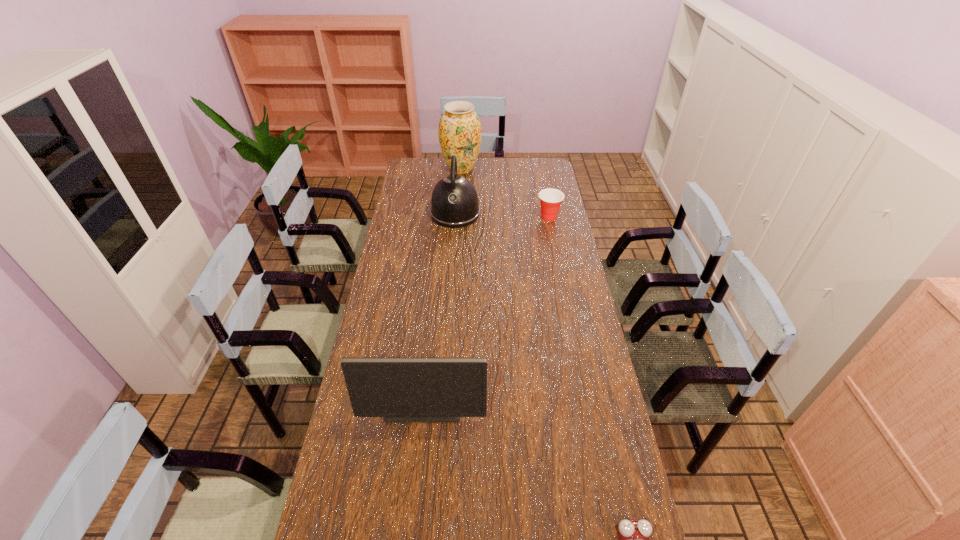
At what (x,y) coordinates should I click in order to perform the action: click on vase. Please return your answer as a coordinate pair (x, y). Looking at the image, I should click on (460, 134).

Locate an element on the screen. The image size is (960, 540). the tallest object is located at coordinates (460, 134).

You are a GUI agent. You are given a task and a screenshot of the screen. Output one action in this format:
    pyautogui.click(x=<x>, y=<y>)
    Task: Click on the kettle
    The image size is (960, 540).
    Given the screenshot: What is the action you would take?
    pyautogui.click(x=454, y=204)

At what (x,y) coordinates should I click in order to perform the action: click on the fourth farthest object. Please return your answer as a coordinate pair (x, y). Looking at the image, I should click on (399, 389).

Identify the location of cup. The image size is (960, 540). (550, 199).

What are the coordinates of `free space located on the right of the tallest object` in the screenshot? It's located at (544, 168).

I want to click on vacant space located 0.070m on the spout of the kettle, so click(453, 240).

The height and width of the screenshot is (540, 960). What are the coordinates of `blank space located 0.130m on the screen side of the computer monitor` in the screenshot? It's located at (417, 468).

Find the location of `vacant region located on the left of the cup`. vacant region located on the left of the cup is located at coordinates (476, 217).

At what (x,y) coordinates should I click in order to perform the action: click on object that is positioned at the far edge. Please return your answer as a coordinate pair (x, y). The height and width of the screenshot is (540, 960). Looking at the image, I should click on (460, 134).